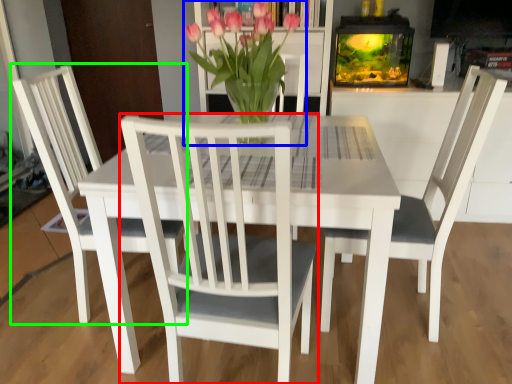
Question: Which is farther away from chair (highlighted by a red box)? houseplant (highlighted by a blue box) or chair (highlighted by a green box)?

Choices:
 (A) houseplant
 (B) chair

Answer: (B)